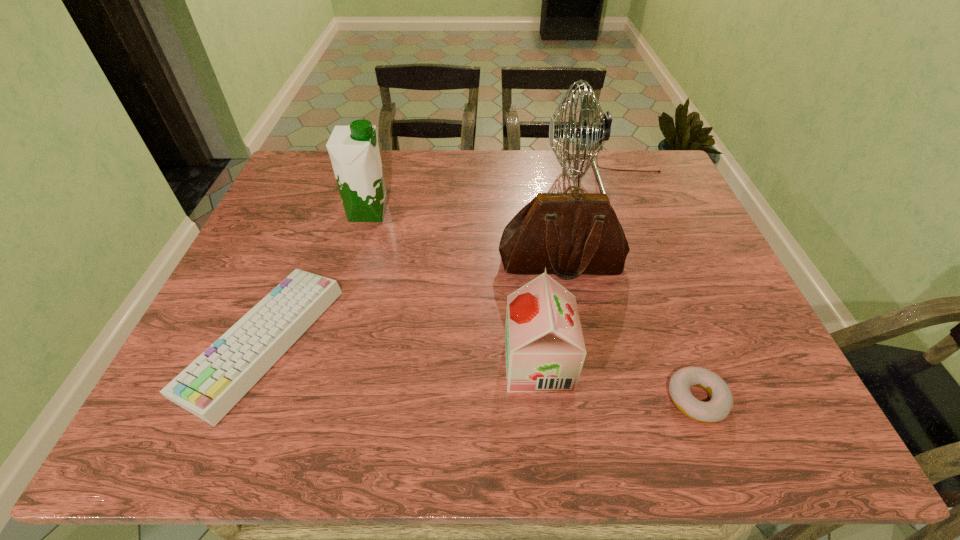
The image size is (960, 540). In order to click on fan in this screenshot , I will do `click(600, 131)`.

Identify the location of the farther soya milk. The height and width of the screenshot is (540, 960). click(x=354, y=151).

In order to click on the left soya milk in this screenshot , I will do `click(354, 151)`.

Locate an element on the screen. The width and height of the screenshot is (960, 540). shoulder bag is located at coordinates coord(570,234).

Locate an element on the screen. the right soya milk is located at coordinates (545, 351).

I want to click on the nearer soya milk, so click(x=545, y=351).

In order to click on computer keyboard in this screenshot , I will do `click(214, 382)`.

The width and height of the screenshot is (960, 540). In order to click on the shortest object in this screenshot , I will do `click(718, 408)`.

I want to click on free point located 0.300m on the front-facing side of the fan, so click(447, 178).

This screenshot has width=960, height=540. I want to click on free space located 0.310m on the front-facing side of the fan, so click(444, 178).